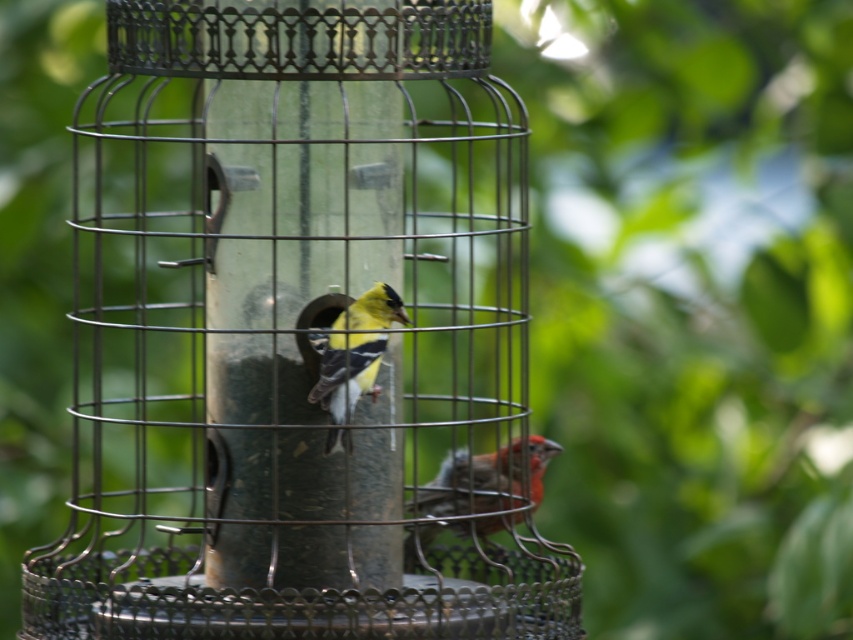
You are a birder observing the scene. You notice the metallic wire bird feeder at center and the yellow matte bird at center. Which object is located to the left of the other?

The metallic wire bird feeder at center is positioned on the left side of yellow matte bird at center, so the metallic wire bird feeder at center is to the left of the yellow matte bird at center.

You are standing at the center of your garden and want to place a new bird feeder exactly where the existing metallic wire bird feeder at center is located. What are the coordinates you should input into your GPS device to place it in the same spot?

The coordinates for the metallic wire bird feeder at center are at point (x=300, y=333). You should input those coordinates into your GPS device to place the new bird feeder in the same location.

You are a birder observing the scene. You notice a point marked at coordinates (x=486, y=480). Which bird is located at this point?

The point at (x=486, y=480) indicates the location of the matte red bird at lower right.